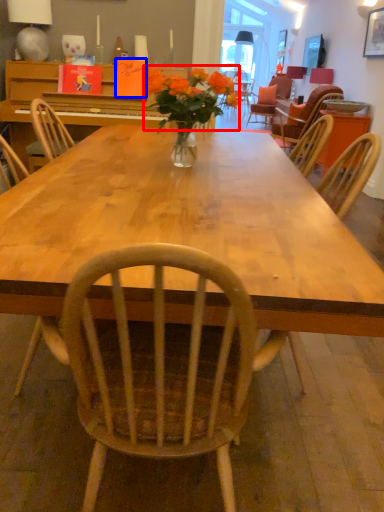
Question: Which object is further to the camera taking this photo, flower (highlighted by a red box) or book (highlighted by a blue box)?

Choices:
 (A) flower
 (B) book

Answer: (B)